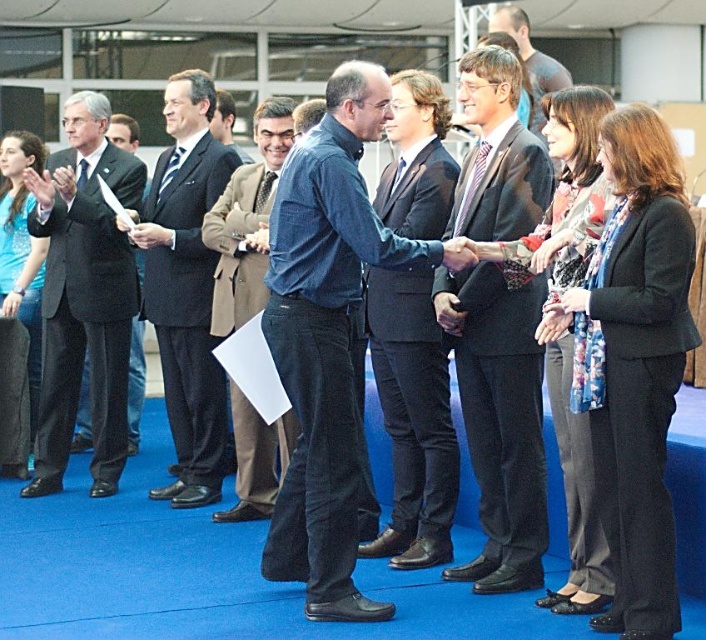
You are attending a formal event and need to find the black wool suit at right. According to the scene description, where is it positioned relative to the dark blue suit at center?

The black wool suit at right is located below the dark blue suit at center.

You are standing at the entrance of the room and want to approach the dark suit at center. According to the coordinates provided, in which direction should you move relative to your current position?

The dark suit at center is located at coordinates point (498, 420). Since you are at the entrance, you should move towards the center of the room to reach it.